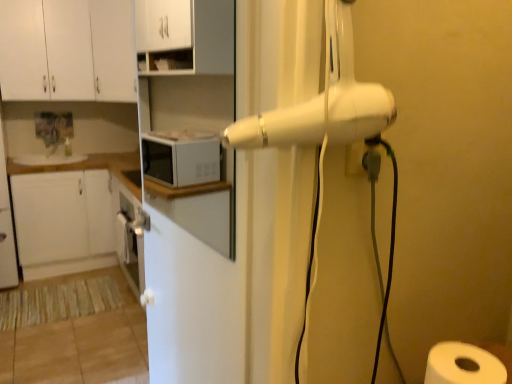
The height and width of the screenshot is (384, 512). Describe the element at coordinates (323, 101) in the screenshot. I see `white plastic hair dryer at upper right` at that location.

The width and height of the screenshot is (512, 384). Find the location of `white matte cabinet at upper center, the second cabinetry positioned from the bottom`. white matte cabinet at upper center, the second cabinetry positioned from the bottom is located at coordinates (185, 37).

Find the location of a particular element. The height and width of the screenshot is (384, 512). white glossy counter top at upper left is located at coordinates (83, 164).

This screenshot has height=384, width=512. In order to click on white matte cabinet at left, the fourth cabinetry when ordered from top to bottom in this screenshot , I will do 63,222.

The width and height of the screenshot is (512, 384). I want to click on white matte cabinet at upper left, which ranks as the third cabinetry in bottom-to-top order, so click(67, 50).

Locate an element on the screen. white glossy screen door at center is located at coordinates (197, 280).

From the image's perspective, is white paper at lower right positioned above or below white plastic hair dryer at upper right?

white paper at lower right is below white plastic hair dryer at upper right.

Considering the relative sizes of white paper at lower right and white plastic hair dryer at upper right in the image provided, is white paper at lower right taller than white plastic hair dryer at upper right?

Incorrect, the height of white paper at lower right is not larger of that of white plastic hair dryer at upper right.

Is white plastic hair dryer at upper right located within white paper at lower right?

Actually, white plastic hair dryer at upper right is outside white paper at lower right.

Is there a large distance between white paper at lower right and white plastic hair dryer at upper right?

No, white paper at lower right is not far from white plastic hair dryer at upper right.

Considering the relative sizes of white glossy counter top at upper left and white matte cabinet at upper left, acting as the fourth cabinetry starting from the bottom, in the image provided, is white glossy counter top at upper left thinner than white matte cabinet at upper left, acting as the fourth cabinetry starting from the bottom,?

No, white glossy counter top at upper left is not thinner than white matte cabinet at upper left, acting as the fourth cabinetry starting from the bottom.

From a real-world perspective, is white glossy counter top at upper left positioned above or below white matte cabinet at upper left, the first cabinetry from the top?

white glossy counter top at upper left is below white matte cabinet at upper left, the first cabinetry from the top.

From the image's perspective, is white glossy counter top at upper left located beneath white matte cabinet at upper left, acting as the fourth cabinetry starting from the bottom?

Indeed, from the image's perspective, white glossy counter top at upper left is shown beneath white matte cabinet at upper left, acting as the fourth cabinetry starting from the bottom.

Which object is thinner, white matte cabinet at left, the 1th cabinetry from the bottom, or white matte cabinet at upper center, the second cabinetry positioned from the bottom?

white matte cabinet at upper center, the second cabinetry positioned from the bottom.

Which is more to the left, white matte cabinet at left, the 1th cabinetry from the bottom, or white matte cabinet at upper center, the second cabinetry positioned from the bottom?

Positioned to the left is white matte cabinet at left, the 1th cabinetry from the bottom.

From a real-world perspective, is white matte cabinet at left, the 1th cabinetry from the bottom, under white matte cabinet at upper center, the second cabinetry positioned from the bottom?

Yes, from a real-world perspective, white matte cabinet at left, the 1th cabinetry from the bottom, is below white matte cabinet at upper center, the second cabinetry positioned from the bottom.

Is white matte cabinet at upper left, which ranks as the third cabinetry in bottom-to-top order, positioned far away from white glossy screen door at center?

No, white matte cabinet at upper left, which ranks as the third cabinetry in bottom-to-top order, is not far from white glossy screen door at center.

Which is more to the right, white matte cabinet at upper left, which ranks as the third cabinetry in bottom-to-top order, or white glossy screen door at center?

Positioned to the right is white glossy screen door at center.

Is white matte cabinet at upper left, the 2th cabinetry from the top, located outside white glossy screen door at center?

Yes, white matte cabinet at upper left, the 2th cabinetry from the top, is not within white glossy screen door at center.

From their relative heights in the image, would you say white matte cabinet at upper left, which ranks as the third cabinetry in bottom-to-top order, is taller or shorter than white glossy screen door at center?

Clearly, white matte cabinet at upper left, which ranks as the third cabinetry in bottom-to-top order, is shorter compared to white glossy screen door at center.

Looking at their sizes, would you say white glossy screen door at center is wider or thinner than white plastic hair dryer at upper right?

In the image, white glossy screen door at center appears to be more narrow than white plastic hair dryer at upper right.

Find the location of a particular element. screen door on the left of white plastic hair dryer at upper right is located at coordinates [197, 280].

Is white glossy screen door at center directly adjacent to white plastic hair dryer at upper right?

white glossy screen door at center and white plastic hair dryer at upper right are not in contact.

Would you say white glossy screen door at center contains white plastic hair dryer at upper right?

Definitely not — white plastic hair dryer at upper right is not inside white glossy screen door at center.

From a real-world perspective, is white plastic hair dryer at upper right beneath white glossy counter top at upper left?

No, from a real-world perspective, white plastic hair dryer at upper right is not under white glossy counter top at upper left.

Between white plastic hair dryer at upper right and white glossy counter top at upper left, which one is positioned behind?

white glossy counter top at upper left.

Between white plastic hair dryer at upper right and white glossy counter top at upper left, which one has larger width?

With larger width is white glossy counter top at upper left.

Considering the relative sizes of white plastic hair dryer at upper right and white glossy counter top at upper left in the image provided, is white plastic hair dryer at upper right smaller than white glossy counter top at upper left?

Indeed, white plastic hair dryer at upper right has a smaller size compared to white glossy counter top at upper left.

Is white matte cabinet at left, the 1th cabinetry from the bottom, far from white glossy counter top at upper left?

No.

Which object is positioned more to the left, white matte cabinet at left, the fourth cabinetry when ordered from top to bottom, or white glossy counter top at upper left?

white glossy counter top at upper left is more to the left.

Consider the image. From a real-world perspective, relative to white glossy counter top at upper left, is white matte cabinet at left, the 1th cabinetry from the bottom, vertically above or below?

From a real-world perspective, white matte cabinet at left, the 1th cabinetry from the bottom, is physically below white glossy counter top at upper left.

From the image's perspective, between white matte cabinet at left, the fourth cabinetry when ordered from top to bottom, and white glossy counter top at upper left, which one is located above?

white glossy counter top at upper left.

Locate an element on the screen. Image resolution: width=512 pixels, height=384 pixels. paper towel below the white plastic hair dryer at upper right (from the image's perspective) is located at coordinates pos(463,366).

From a real-world perspective, which cabinetry is the 3rd one above the white glossy counter top at upper left? Please provide its 2D coordinates.

[(113, 50)]

From the image, which object appears to be farther from white paper at lower right, white matte cabinet at left, the fourth cabinetry when ordered from top to bottom, or white plastic hair dryer at upper right?

Among the two, white matte cabinet at left, the fourth cabinetry when ordered from top to bottom, is located further to white paper at lower right.

When comparing their distances from white matte cabinet at left, the fourth cabinetry when ordered from top to bottom, does white glossy screen door at center or white glossy counter top at upper left seem further?

white glossy screen door at center.

Which object lies further to the anchor point white matte cabinet at upper center, the second cabinetry positioned from the bottom, white matte cabinet at upper left, which ranks as the third cabinetry in bottom-to-top order, or white glossy screen door at center?

The object further to white matte cabinet at upper center, the second cabinetry positioned from the bottom, is white matte cabinet at upper left, which ranks as the third cabinetry in bottom-to-top order.

Looking at the image, which one is located further to white plastic hair dryer at upper right, white glossy counter top at upper left or white matte cabinet at left, the 1th cabinetry from the bottom?

The object further to white plastic hair dryer at upper right is white matte cabinet at left, the 1th cabinetry from the bottom.

When comparing their distances from white matte cabinet at upper left, acting as the fourth cabinetry starting from the bottom, does white matte cabinet at upper left, which ranks as the third cabinetry in bottom-to-top order, or white plastic hair dryer at upper right seem closer?

white matte cabinet at upper left, which ranks as the third cabinetry in bottom-to-top order.

Which object lies further to the anchor point white glossy screen door at center, white matte cabinet at upper center, the 3th cabinetry viewed from the top, or white matte cabinet at left, the 1th cabinetry from the bottom?

white matte cabinet at left, the 1th cabinetry from the bottom, is positioned further to the anchor white glossy screen door at center.

When comparing their distances from white matte cabinet at left, the 1th cabinetry from the bottom, does white glossy screen door at center or white plastic hair dryer at upper right seem closer?

white glossy screen door at center is positioned closer to the anchor white matte cabinet at left, the 1th cabinetry from the bottom.

Considering their positions, is white matte cabinet at upper center, the second cabinetry positioned from the bottom, positioned further to white matte cabinet at left, the 1th cabinetry from the bottom, than white glossy screen door at center?

Based on the image, white matte cabinet at upper center, the second cabinetry positioned from the bottom, appears to be further to white matte cabinet at left, the 1th cabinetry from the bottom.

Locate an element on the screen. The height and width of the screenshot is (384, 512). cabinetry between white paper at lower right and white matte cabinet at upper left, the 2th cabinetry from the top, from front to back is located at coordinates (185, 37).

Find the location of a particular element. paper towel positioned between white glossy screen door at center and white matte cabinet at upper center, the 3th cabinetry viewed from the top, from near to far is located at coordinates (x=463, y=366).

This screenshot has height=384, width=512. What are the coordinates of `paper towel between white plastic hair dryer at upper right and white matte cabinet at upper center, the 3th cabinetry viewed from the top, from front to back` in the screenshot? It's located at (463, 366).

Where is `screen door located between white plastic hair dryer at upper right and white glossy counter top at upper left in the depth direction`? screen door located between white plastic hair dryer at upper right and white glossy counter top at upper left in the depth direction is located at coordinates (197, 280).